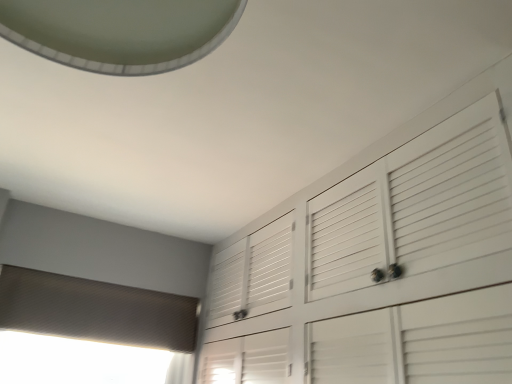
Question: From their relative heights in the image, would you say white glossy exhaust hood at upper left is taller or shorter than textured gray blind at lower left?

Choices:
 (A) short
 (B) tall

Answer: (B)

Question: From a real-world perspective, is white glossy exhaust hood at upper left above or below textured gray blind at lower left?

Choices:
 (A) above
 (B) below

Answer: (A)

Question: Does point (33, 8) appear closer or farther from the camera than point (96, 306)?

Choices:
 (A) closer
 (B) farther

Answer: (A)

Question: In the image, is textured gray blind at lower left on the left side or the right side of white glossy exhaust hood at upper left?

Choices:
 (A) left
 (B) right

Answer: (A)

Question: From a real-world perspective, is textured gray blind at lower left physically located above or below white glossy exhaust hood at upper left?

Choices:
 (A) above
 (B) below

Answer: (B)

Question: Looking at their shapes, would you say textured gray blind at lower left is wider or thinner than white glossy exhaust hood at upper left?

Choices:
 (A) thin
 (B) wide

Answer: (A)

Question: Is textured gray blind at lower left in front of or behind white glossy exhaust hood at upper left in the image?

Choices:
 (A) front
 (B) behind

Answer: (B)